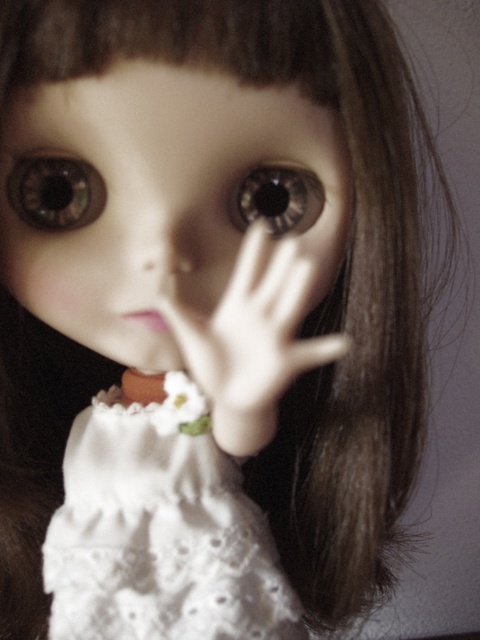
Looking at the doll in the image, which object is smaller between the brown glossy eye at center and the matte plastic nose at center?

The brown glossy eye at center is smaller than the matte plastic nose at center.

You are an art restorer examining the doll. You need to apply a protective coating to both the matte porcelain doll face at center and the brown glossy eye at upper left. Based on their positions, which object should you start with to follow a left to right work pattern?

The brown glossy eye at upper left should be addressed first because it is positioned to the left of the matte porcelain doll face at center, aligning with a left to right work pattern.

You are a toy repair technician who needs to place a new brown glossy eye at upper left onto the matte porcelain doll face at center. What is the minimum distance you should maintain between the eye and the face?

The minimum distance you should maintain between the matte porcelain doll face at center and the brown glossy eye at upper left is 2.14 inches, as that is the existing spacing between them.